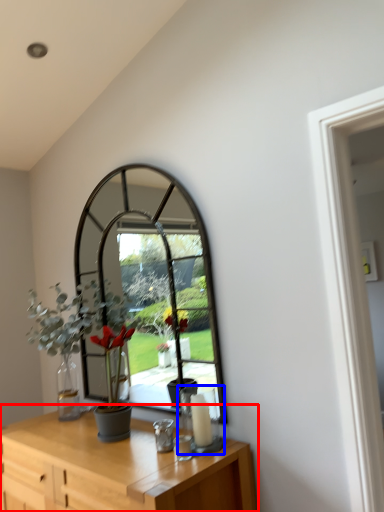
Question: Which object appears closest to the camera in this image, table (highlighted by a red box) or candle holder (highlighted by a blue box)?

Choices:
 (A) table
 (B) candle holder

Answer: (A)